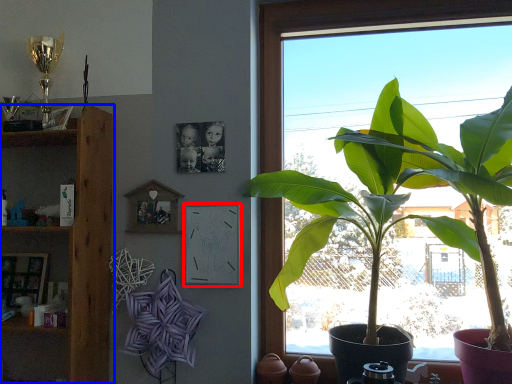
Question: Which object is further to the camera taking this photo, picture frame (highlighted by a red box) or shelf (highlighted by a blue box)?

Choices:
 (A) picture frame
 (B) shelf

Answer: (A)